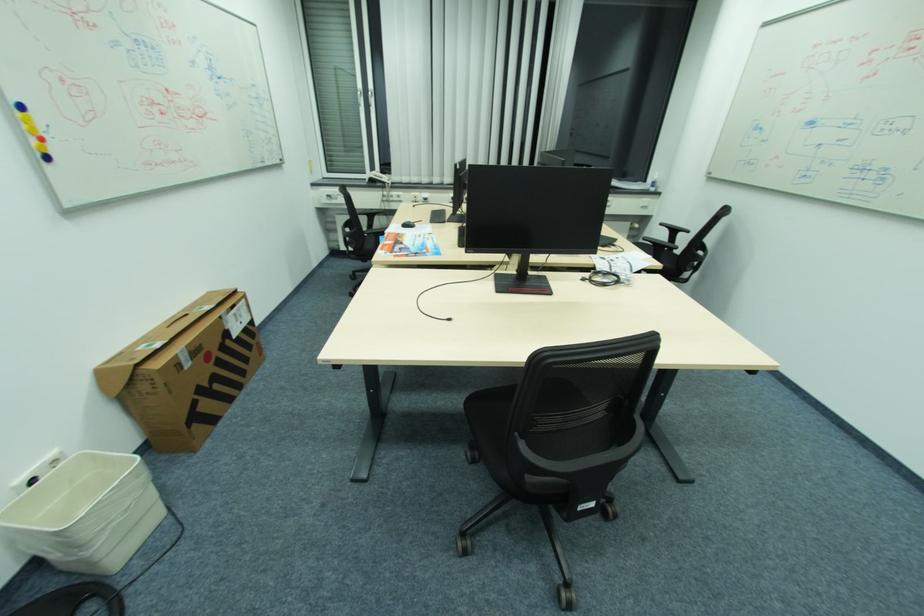
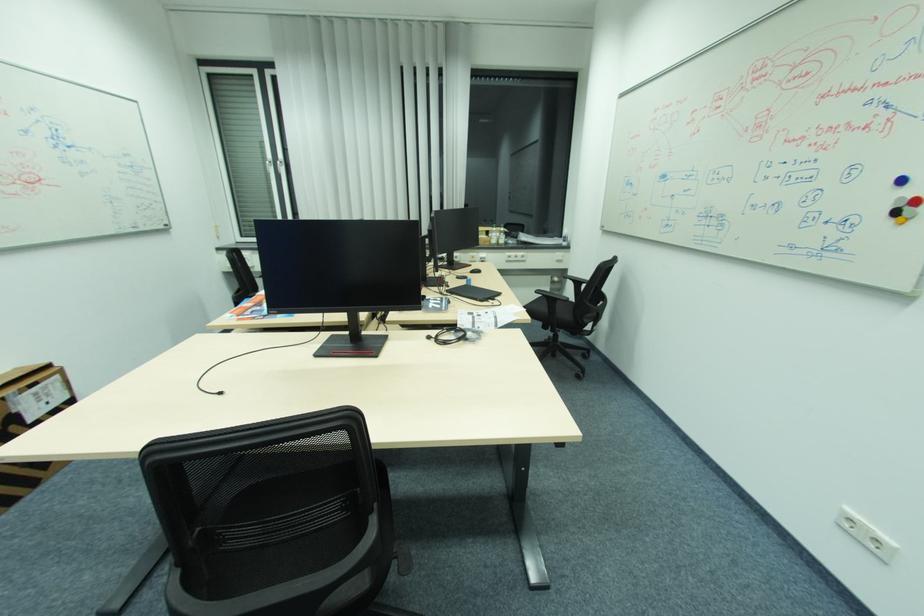
The point at [589,280] is marked in the first image. Where is the corresponding point in the second image?

(434, 338)